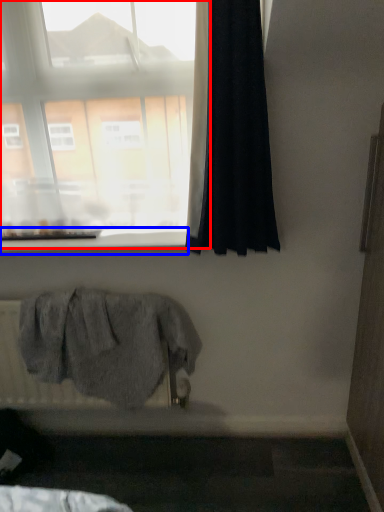
Question: Which of the following is the farthest to the observer, window (highlighted by a red box) or window sill (highlighted by a blue box)?

Choices:
 (A) window
 (B) window sill

Answer: (B)